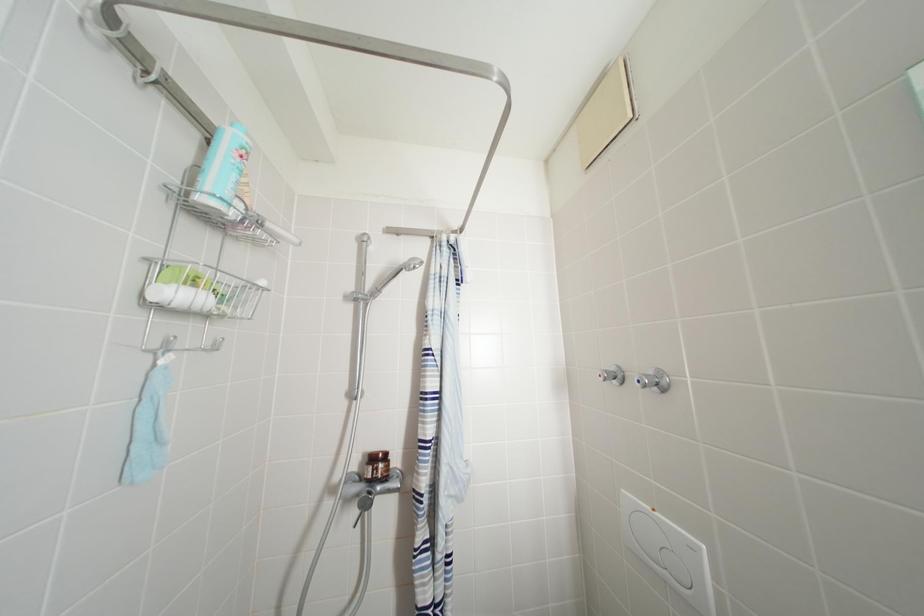
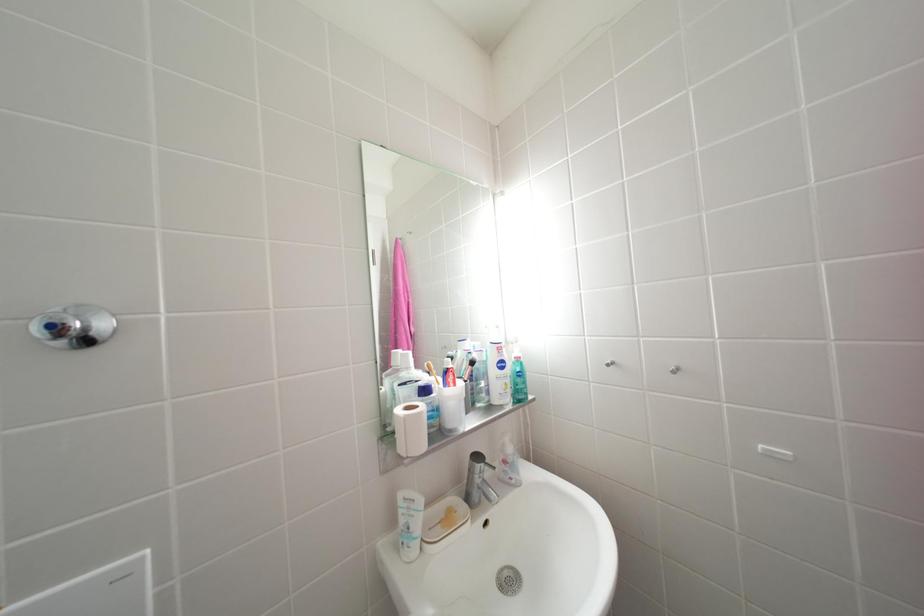
Question: The camera is either moving clockwise (left) or counter-clockwise (right) around the object. The first image is from the beginning of the video and the second image is from the end. Is the camera moving left or right when shooting the video?

Choices:
 (A) Left
 (B) Right

Answer: (A)